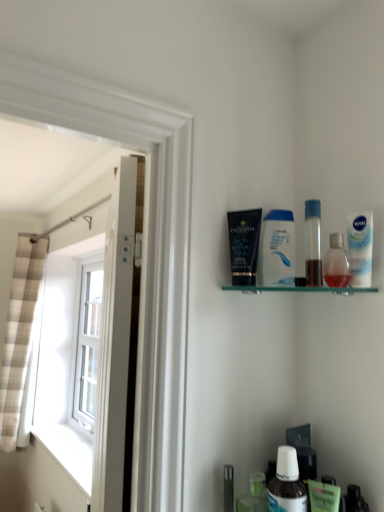
Question: From a real-world perspective, is plaid fabric curtain at left above or below transparent plastic bottle at upper right, which is counted as the first mouthwash, starting from the top?

Choices:
 (A) below
 (B) above

Answer: (A)

Question: Choose the correct answer: Is plaid fabric curtain at left inside transparent plastic bottle at upper right, positioned as the 3th mouthwash in right-to-left order, or outside it?

Choices:
 (A) inside
 (B) outside

Answer: (B)

Question: Which is farther from the translucent plastic bottle at lower center, the third toiletry viewed from the top?

Choices:
 (A) matte black tube at upper center, which appears as the 3th toiletry when ordered from the bottom
 (B) white glossy door at left
 (C) clear glass shelf at upper right
 (D) white glossy lotion at center
 (E) white matte nivea mouthwash at upper right, the 2th mouthwash in the top-to-bottom sequence

Answer: (E)

Question: Which object is the closest to the clear glass shelf at upper right?

Choices:
 (A) white plastic mouthwash at lower center, the fourth mouthwash in the right-to-left sequence
 (B) transparent plastic spray bottle at upper right, the 2th toiletry positioned from the bottom
 (C) matte black tube at upper center, acting as the 1th toiletry starting from the left
 (D) white matte nivea mouthwash at upper right, placed as the 4th mouthwash when sorted from left to right
 (E) white glossy door at left

Answer: (B)